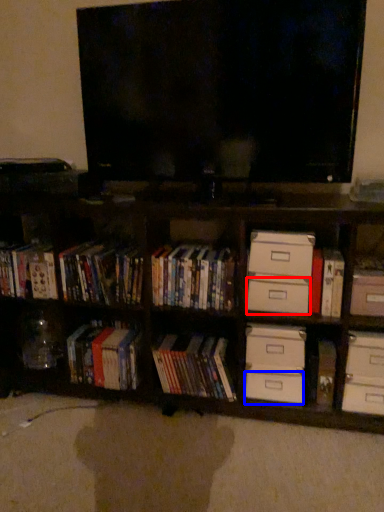
Question: Which object is closer to the camera taking this photo, drawer (highlighted by a red box) or drawer (highlighted by a blue box)?

Choices:
 (A) drawer
 (B) drawer

Answer: (A)